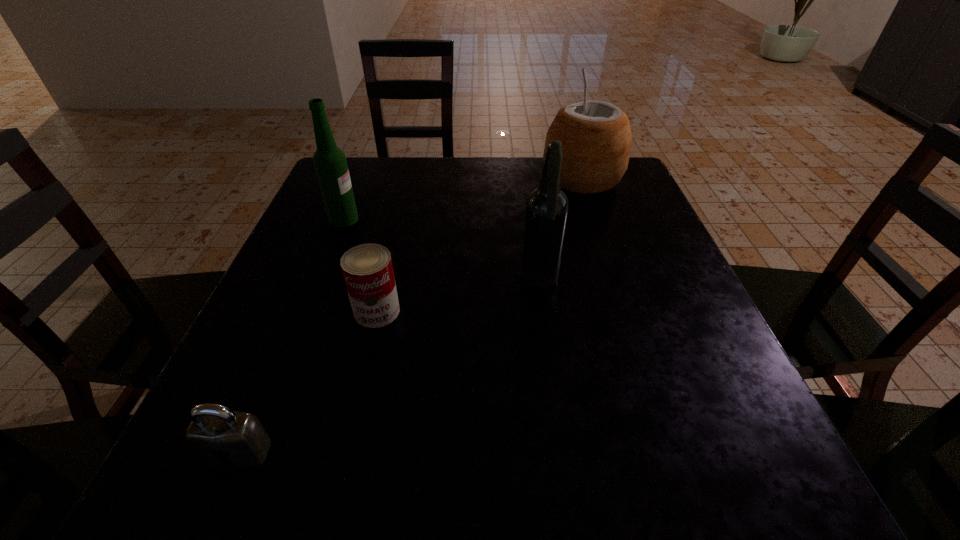
Locate an element on the screen. The width and height of the screenshot is (960, 540). free space located 0.150m on the front of the farthest object is located at coordinates (602, 241).

Where is `free space located 0.090m on the front label of the third object from right to left`? The height and width of the screenshot is (540, 960). free space located 0.090m on the front label of the third object from right to left is located at coordinates (363, 372).

Where is `object located at the far edge`? This screenshot has height=540, width=960. object located at the far edge is located at coordinates click(x=596, y=137).

This screenshot has width=960, height=540. I want to click on object that is at the near edge, so click(215, 428).

At what (x,y) coordinates should I click in order to perform the action: click on beer bottle at the left edge. Please return your answer as a coordinate pair (x, y). Image resolution: width=960 pixels, height=540 pixels. Looking at the image, I should click on (330, 163).

Locate an element on the screen. padlock that is at the left edge is located at coordinates [x=215, y=428].

I want to click on object situated at the right edge, so click(596, 137).

Locate an element on the screen. object that is positioned at the near left corner is located at coordinates (215, 428).

Where is `object situated at the far right corner`? The width and height of the screenshot is (960, 540). object situated at the far right corner is located at coordinates (596, 137).

Locate an element on the screen. Image resolution: width=960 pixels, height=540 pixels. vacant space at the far edge of the desktop is located at coordinates (506, 194).